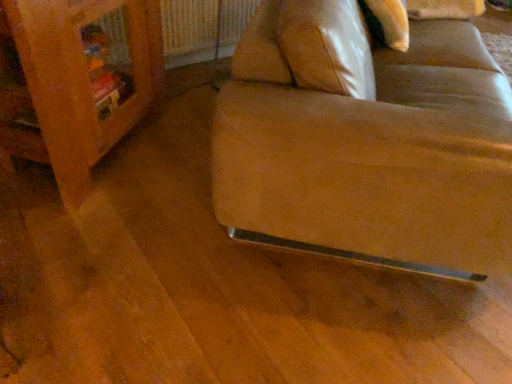
Describe the element at coordinates (368, 148) in the screenshot. Image resolution: width=512 pixels, height=384 pixels. I see `leather at lower right` at that location.

What is the approximate height of wooden bookshelf at left?

The height of wooden bookshelf at left is 30.18 inches.

I want to click on wooden bookshelf at left, so click(73, 83).

Measure the distance between point (164, 8) and camera.

Point (164, 8) and camera are 2.14 meters apart from each other.

The height and width of the screenshot is (384, 512). What do you see at coordinates (202, 28) in the screenshot? I see `metallic silver radiator at upper center` at bounding box center [202, 28].

This screenshot has width=512, height=384. Identify the location of leather at lower right. (368, 148).

How many degrees apart are the facing directions of leather at lower right and wooden bookshelf at left?

The facing directions of leather at lower right and wooden bookshelf at left are 5.55 degrees apart.

Is leather at lower right positioned with its back to wooden bookshelf at left?

Yes, leather at lower right is positioned with its back facing wooden bookshelf at left.

From the image's perspective, which is below, leather at lower right or wooden bookshelf at left?

wooden bookshelf at left.

Which is more to the right, leather at lower right or wooden bookshelf at left?

leather at lower right is more to the right.

Which object is further away from the camera, leather at lower right or metallic silver radiator at upper center?

metallic silver radiator at upper center is further from the camera.

Is leather at lower right not within metallic silver radiator at upper center?

Answer: Absolutely, leather at lower right is external to metallic silver radiator at upper center.

Are leather at lower right and metallic silver radiator at upper center far apart?

Absolutely, leather at lower right is distant from metallic silver radiator at upper center.

Can you confirm if leather at lower right is positioned to the right of metallic silver radiator at upper center?

Indeed, leather at lower right is positioned on the right side of metallic silver radiator at upper center.

From the image's perspective, which object appears higher, wooden bookshelf at left or metallic silver radiator at upper center?

metallic silver radiator at upper center appears higher in the image.

Would you say wooden bookshelf at left contains metallic silver radiator at upper center?

No, metallic silver radiator at upper center is located outside of wooden bookshelf at left.

Between wooden bookshelf at left and metallic silver radiator at upper center, which one is positioned in front?

wooden bookshelf at left is in front.

From their relative heights in the image, would you say metallic silver radiator at upper center is taller or shorter than leather at lower right?

Considering their sizes, metallic silver radiator at upper center has less height than leather at lower right.

From a real-world perspective, who is located higher, metallic silver radiator at upper center or leather at lower right?

In real-world perspective, leather at lower right is above.

Can you tell me how much metallic silver radiator at upper center and leather at lower right differ in facing direction?

They differ by 45.6 degrees in their facing directions.

Can you tell me how much metallic silver radiator at upper center and wooden bookshelf at left differ in facing direction?

There is a 40.1-degree angle between the facing directions of metallic silver radiator at upper center and wooden bookshelf at left.

Is metallic silver radiator at upper center thinner than wooden bookshelf at left?

Yes, metallic silver radiator at upper center is thinner than wooden bookshelf at left.

From the image's perspective, who appears lower, metallic silver radiator at upper center or wooden bookshelf at left?

wooden bookshelf at left.

Which object is positioned more to the left, metallic silver radiator at upper center or wooden bookshelf at left?

Positioned to the left is wooden bookshelf at left.

Does wooden bookshelf at left have a smaller size compared to leather at lower right?

Yes.

From the image's perspective, is wooden bookshelf at left positioned above or below leather at lower right?

From the image's perspective, wooden bookshelf at left appears below leather at lower right.

This screenshot has width=512, height=384. In order to click on studio couch above the wooden bookshelf at left (from the image's perspective) in this screenshot , I will do `click(368, 148)`.

In order to click on studio couch on the right of wooden bookshelf at left in this screenshot , I will do `click(368, 148)`.

This screenshot has width=512, height=384. In the image, there is a leather at lower right. In order to click on radiator below it (from a real-world perspective) in this screenshot , I will do `click(202, 28)`.

Which object lies nearer to the anchor point metallic silver radiator at upper center, leather at lower right or wooden bookshelf at left?

The object closer to metallic silver radiator at upper center is wooden bookshelf at left.

Considering their positions, is metallic silver radiator at upper center positioned closer to leather at lower right than wooden bookshelf at left?

wooden bookshelf at left lies closer to leather at lower right than the other object.

Which object lies nearer to the anchor point metallic silver radiator at upper center, wooden bookshelf at left or leather at lower right?

wooden bookshelf at left is positioned closer to the anchor metallic silver radiator at upper center.

Which object lies further to the anchor point wooden bookshelf at left, leather at lower right or metallic silver radiator at upper center?

leather at lower right is positioned further to the anchor wooden bookshelf at left.

Based on their spatial positions, is metallic silver radiator at upper center or leather at lower right further from wooden bookshelf at left?

leather at lower right.

From the image, which object appears to be farther from leather at lower right, wooden bookshelf at left or metallic silver radiator at upper center?

The object further to leather at lower right is metallic silver radiator at upper center.

Locate an element on the screen. furniture between leather at lower right and metallic silver radiator at upper center from front to back is located at coordinates (73, 83).